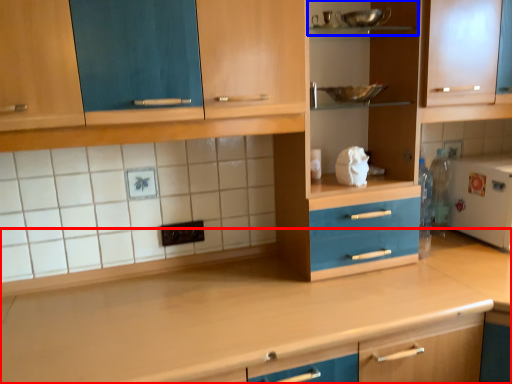
Question: Among these objects, which one is nearest to the camera, countertop (highlighted by a red box) or shelf (highlighted by a blue box)?

Choices:
 (A) countertop
 (B) shelf

Answer: (A)